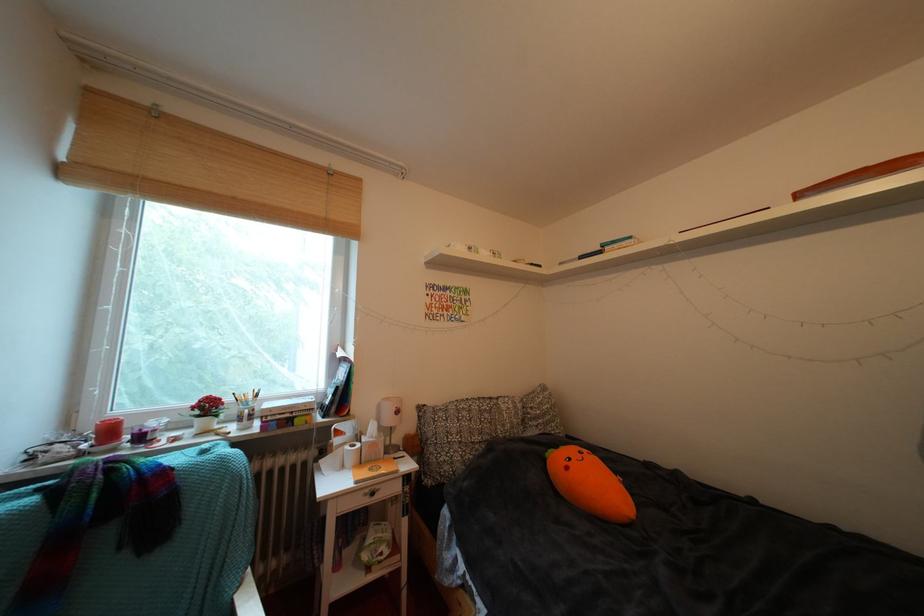
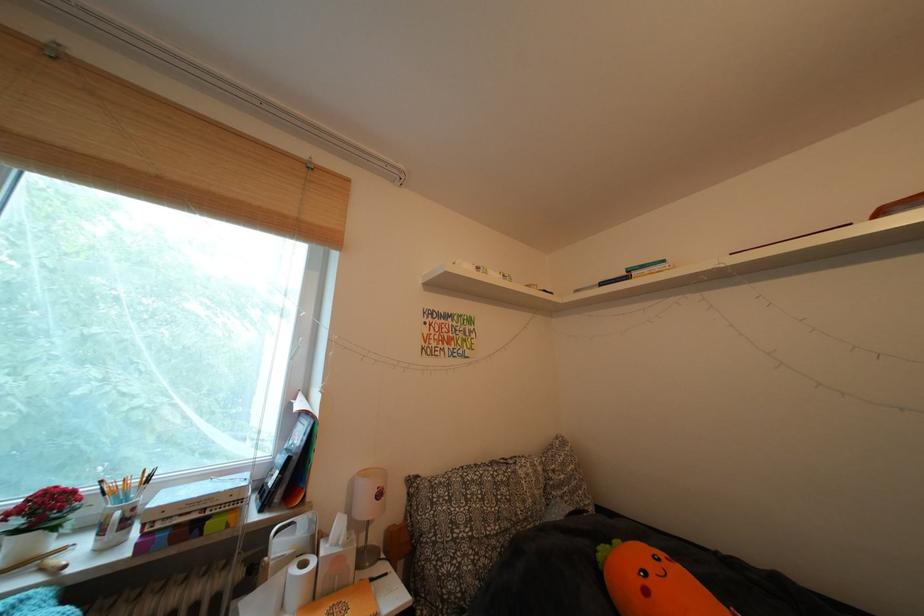
The point at (x=219, y=411) is marked in the first image. Where is the corresponding point in the second image?

(56, 513)